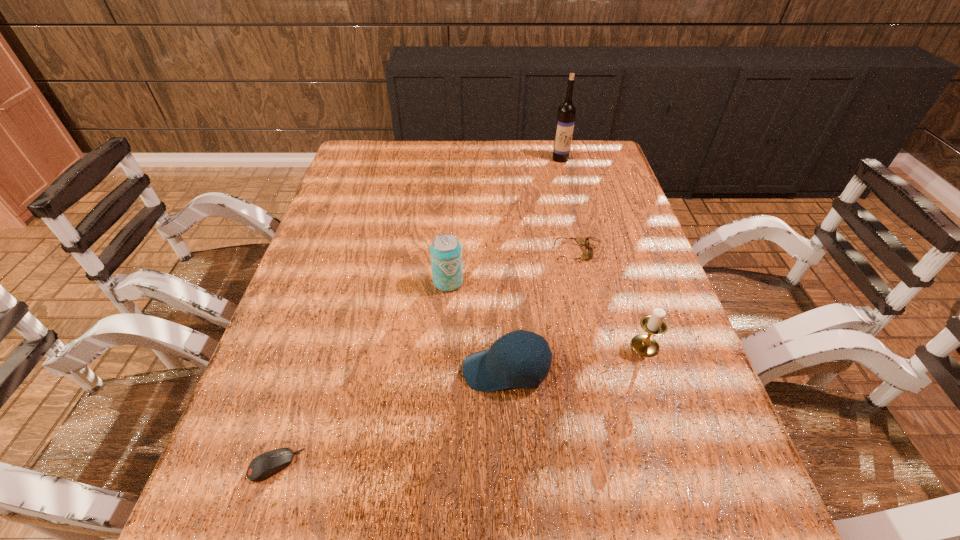
At what (x,y) coordinates should I click in order to perform the action: click on vacant space positioned 0.110m on the back of the shortest object. Please return your answer as a coordinate pair (x, y). Looking at the image, I should click on (299, 394).

Find the location of a particular element. This screenshot has height=540, width=960. object that is positioned at the far edge is located at coordinates (566, 112).

Identify the location of object that is at the left edge. The height and width of the screenshot is (540, 960). (266, 464).

This screenshot has width=960, height=540. Find the location of `wine bottle at the right edge`. wine bottle at the right edge is located at coordinates (566, 112).

You are a GUI agent. You are given a task and a screenshot of the screen. Output one action in this format:
    pyautogui.click(x=<x>, y=<y>)
    Task: Click on the candle holder at the right edge
    Image resolution: width=960 pixels, height=540 pixels.
    Given the screenshot: What is the action you would take?
    (x=654, y=324)

The width and height of the screenshot is (960, 540). Find the location of `spectacles at the right edge`. spectacles at the right edge is located at coordinates (581, 241).

Locate an element on the screen. object situated at the far right corner is located at coordinates (566, 112).

This screenshot has height=540, width=960. In order to click on blank space at the far edge in this screenshot , I will do (438, 153).

Where is `vacant region at the left edge of the desktop`? The height and width of the screenshot is (540, 960). vacant region at the left edge of the desktop is located at coordinates (342, 342).

Identify the location of vacant space at the right edge of the desktop. The image size is (960, 540). (672, 442).